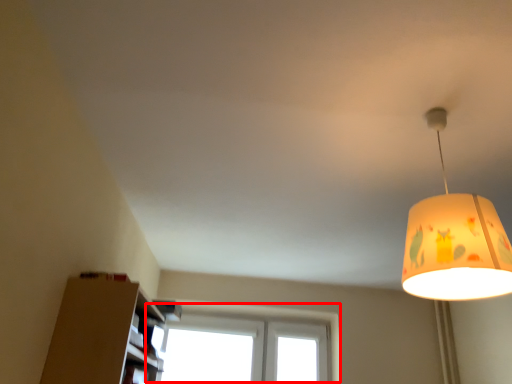
Question: From the image's perspective, what is the correct spatial relationship of window (annotated by the red box) in relation to lamp?

Choices:
 (A) above
 (B) below

Answer: (B)